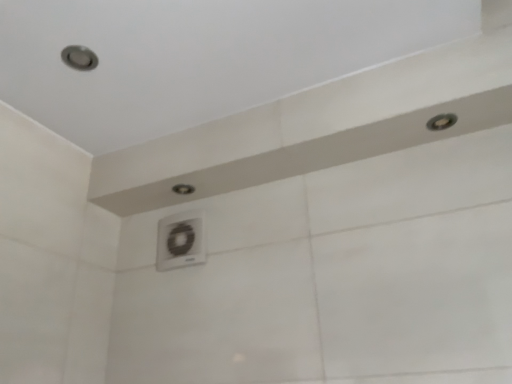
Image resolution: width=512 pixels, height=384 pixels. What do you see at coordinates (183, 189) in the screenshot? I see `matte white shower at center, acting as the 2th shower starting from the top` at bounding box center [183, 189].

You are a GUI agent. You are given a task and a screenshot of the screen. Output one action in this format:
    pyautogui.click(x=<x>, y=<y>)
    Task: Click on the matte silver shower at upper right, the 2th shower when ordered from left to right
    The width and height of the screenshot is (512, 384).
    Given the screenshot: What is the action you would take?
    pyautogui.click(x=441, y=122)

Image resolution: width=512 pixels, height=384 pixels. What do you see at coordinates (181, 240) in the screenshot? I see `white plastic air conditioner at center` at bounding box center [181, 240].

Identify the location of matte white shower at center, the first shower ordered from the bottom. The height and width of the screenshot is (384, 512). (183, 189).

Is matte silver shower at upper right, the first shower from the front, a part of white plastic air conditioner at center?

No, matte silver shower at upper right, the first shower from the front, is located outside of white plastic air conditioner at center.

Based on their positions, is white plastic air conditioner at center located to the left or right of matte silver shower at upper right, positioned as the 1th shower in top-to-bottom order?

white plastic air conditioner at center is to the left of matte silver shower at upper right, positioned as the 1th shower in top-to-bottom order.

From the image's perspective, is white plastic air conditioner at center under matte silver shower at upper right, the 2th shower when ordered from left to right?

Yes.

Between matte silver shower at upper right, the first shower from the front, and white plastic air conditioner at center, which one has more height?

With more height is white plastic air conditioner at center.

Considering the sizes of matte silver shower at upper right, placed as the 2th shower when sorted from back to front, and white plastic air conditioner at center in the image, is matte silver shower at upper right, placed as the 2th shower when sorted from back to front, wider or thinner than white plastic air conditioner at center?

matte silver shower at upper right, placed as the 2th shower when sorted from back to front, is wider than white plastic air conditioner at center.

Is matte silver shower at upper right, the 2th shower when ordered from left to right, spatially inside white plastic air conditioner at center, or outside of it?

matte silver shower at upper right, the 2th shower when ordered from left to right, is not enclosed by white plastic air conditioner at center.

Considering the relative sizes of white plastic air conditioner at center and matte white shower at center, the second shower in the front-to-back sequence, in the image provided, is white plastic air conditioner at center smaller than matte white shower at center, the second shower in the front-to-back sequence,?

Actually, white plastic air conditioner at center might be larger than matte white shower at center, the second shower in the front-to-back sequence.

Identify the location of air conditioner that appears on the left of matte white shower at center, which is the first shower from back to front. (181, 240).

From a real-world perspective, relative to matte white shower at center, positioned as the 1th shower in left-to-right order, is white plastic air conditioner at center vertically above or below?

Clearly, from a real-world perspective, white plastic air conditioner at center is below matte white shower at center, positioned as the 1th shower in left-to-right order.

Considering the positions of objects white plastic air conditioner at center and matte white shower at center, acting as the 2th shower starting from the top, in the image provided, who is in front, white plastic air conditioner at center or matte white shower at center, acting as the 2th shower starting from the top,?

white plastic air conditioner at center is closer to the camera.

Considering the positions of points (190, 191) and (162, 257), is point (190, 191) farther from camera compared to point (162, 257)?

Yes, point (190, 191) is farther from viewer.

Is matte white shower at center, acting as the 2th shower starting from the top, bigger than white plastic air conditioner at center?

No, matte white shower at center, acting as the 2th shower starting from the top, is not bigger than white plastic air conditioner at center.

Considering the relative sizes of matte white shower at center, the first shower ordered from the bottom, and white plastic air conditioner at center in the image provided, is matte white shower at center, the first shower ordered from the bottom, wider than white plastic air conditioner at center?

Yes.

Does matte white shower at center, the first shower ordered from the bottom, appear on the right side of white plastic air conditioner at center?

Yes, matte white shower at center, the first shower ordered from the bottom, is to the right of white plastic air conditioner at center.

Who is shorter, matte silver shower at upper right, which is the first shower in right-to-left order, or matte white shower at center, the first shower ordered from the bottom?

matte silver shower at upper right, which is the first shower in right-to-left order, is shorter.

Is matte silver shower at upper right, which is the first shower in right-to-left order, located outside matte white shower at center, which is the first shower from back to front?

Absolutely, matte silver shower at upper right, which is the first shower in right-to-left order, is external to matte white shower at center, which is the first shower from back to front.

Is matte silver shower at upper right, placed as the 2th shower when sorted from back to front, touching matte white shower at center, the first shower ordered from the bottom?

No, matte silver shower at upper right, placed as the 2th shower when sorted from back to front, is not beside matte white shower at center, the first shower ordered from the bottom.

Relative to matte white shower at center, the second shower in the front-to-back sequence, is matte silver shower at upper right, positioned as the 1th shower in top-to-bottom order, in front or behind?

In the image, matte silver shower at upper right, positioned as the 1th shower in top-to-bottom order, appears in front of matte white shower at center, the second shower in the front-to-back sequence.

From a real-world perspective, who is located higher, matte white shower at center, the second shower in the front-to-back sequence, or matte silver shower at upper right, the 2th shower when ordered from left to right?

matte silver shower at upper right, the 2th shower when ordered from left to right, from a real-world perspective.

Is matte white shower at center, which is the first shower from back to front, facing away from matte silver shower at upper right, the first shower from the front?

That's right, matte white shower at center, which is the first shower from back to front, is facing away from matte silver shower at upper right, the first shower from the front.

Is matte white shower at center, acting as the 2th shower starting from the top, far away from matte silver shower at upper right, positioned as the 1th shower in top-to-bottom order?

No, matte white shower at center, acting as the 2th shower starting from the top, is in close proximity to matte silver shower at upper right, positioned as the 1th shower in top-to-bottom order.

From the image's perspective, is matte white shower at center, placed as the second shower when sorted from right to left, under matte silver shower at upper right, the first shower from the front?

Yes, from the image's perspective, matte white shower at center, placed as the second shower when sorted from right to left, is beneath matte silver shower at upper right, the first shower from the front.

Where is `air conditioner located behind the matte silver shower at upper right, the first shower from the front`? This screenshot has width=512, height=384. air conditioner located behind the matte silver shower at upper right, the first shower from the front is located at coordinates (181, 240).

Locate an element on the screen. air conditioner below the matte silver shower at upper right, which is the first shower in right-to-left order (from a real-world perspective) is located at coordinates (181, 240).

Looking at the image, which one is located further to matte white shower at center, which is the first shower from back to front, white plastic air conditioner at center or matte silver shower at upper right, marked as the 2th shower in a bottom-to-top arrangement?

Based on the image, matte silver shower at upper right, marked as the 2th shower in a bottom-to-top arrangement, appears to be further to matte white shower at center, which is the first shower from back to front.

Estimate the real-world distances between objects in this image. Which object is further from matte silver shower at upper right, positioned as the 1th shower in top-to-bottom order, matte white shower at center, placed as the second shower when sorted from right to left, or white plastic air conditioner at center?

white plastic air conditioner at center lies further to matte silver shower at upper right, positioned as the 1th shower in top-to-bottom order, than the other object.

From the image, which object appears to be farther from matte white shower at center, placed as the second shower when sorted from right to left, matte silver shower at upper right, marked as the 2th shower in a bottom-to-top arrangement, or white plastic air conditioner at center?

Among the two, matte silver shower at upper right, marked as the 2th shower in a bottom-to-top arrangement, is located further to matte white shower at center, placed as the second shower when sorted from right to left.

Looking at the image, which one is located closer to white plastic air conditioner at center, matte silver shower at upper right, marked as the 2th shower in a bottom-to-top arrangement, or matte white shower at center, the first shower ordered from the bottom?

matte white shower at center, the first shower ordered from the bottom, is closer to white plastic air conditioner at center.

From the image, which object appears to be farther from white plastic air conditioner at center, matte white shower at center, positioned as the 1th shower in left-to-right order, or matte silver shower at upper right, the 2th shower when ordered from left to right?

matte silver shower at upper right, the 2th shower when ordered from left to right, lies further to white plastic air conditioner at center than the other object.

When comparing their distances from matte silver shower at upper right, positioned as the 1th shower in top-to-bottom order, does white plastic air conditioner at center or matte white shower at center, which is the first shower from back to front, seem further?

white plastic air conditioner at center is positioned further to the anchor matte silver shower at upper right, positioned as the 1th shower in top-to-bottom order.

What are the coordinates of `shower between white plastic air conditioner at center and matte silver shower at upper right, marked as the 2th shower in a bottom-to-top arrangement, from left to right` in the screenshot? It's located at (183, 189).